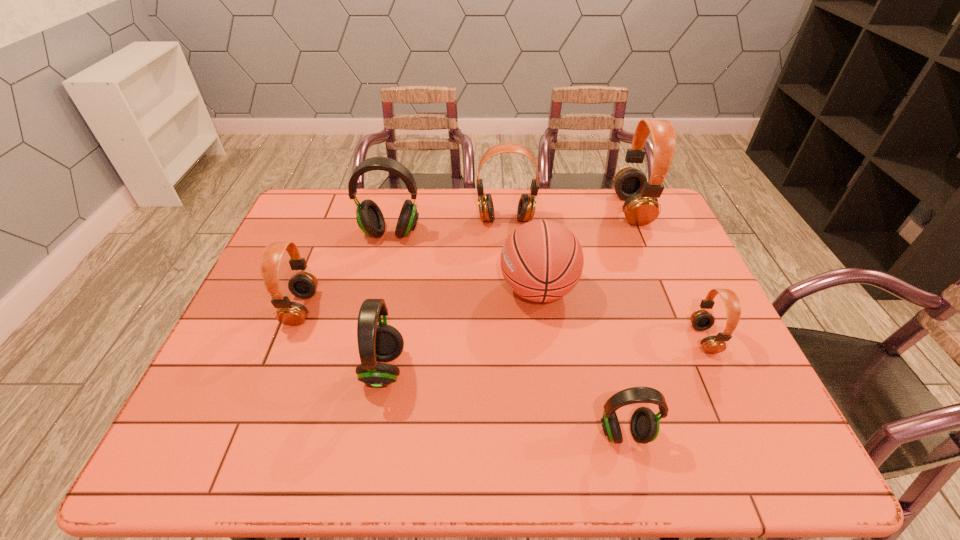
The height and width of the screenshot is (540, 960). What are the coordinates of `blank area located on the ear cups of the second smallest brown headset` in the screenshot? It's located at (424, 308).

Identify the location of blank area located on the ear cups of the second farthest black headset. (490, 369).

Find the location of a particular element. The image size is (960, 540). vacant region located on the ear cups of the smallest brown headset is located at coordinates (616, 339).

Locate an element on the screen. free space located 0.370m on the ear cups of the smallest brown headset is located at coordinates (544, 339).

Locate an element on the screen. The width and height of the screenshot is (960, 540). blank space located 0.090m on the ear cups of the smallest brown headset is located at coordinates (657, 339).

Find the location of a particular element. This screenshot has height=540, width=960. object situated at the near edge is located at coordinates (644, 425).

Find the location of a particular element. Image resolution: width=960 pixels, height=540 pixels. object positioned at the left edge is located at coordinates (303, 284).

You are a GUI agent. You are given a task and a screenshot of the screen. Output one action in this format:
    pyautogui.click(x=<x>, y=<y>)
    Task: Click on the object that is at the far right corner
    
    Given the screenshot: What is the action you would take?
    pyautogui.click(x=641, y=207)

The height and width of the screenshot is (540, 960). Identify the location of blank space at the far edge of the desktop. (474, 211).

Where is `vacant space at the near edge of the desktop`? This screenshot has height=540, width=960. vacant space at the near edge of the desktop is located at coordinates (407, 468).